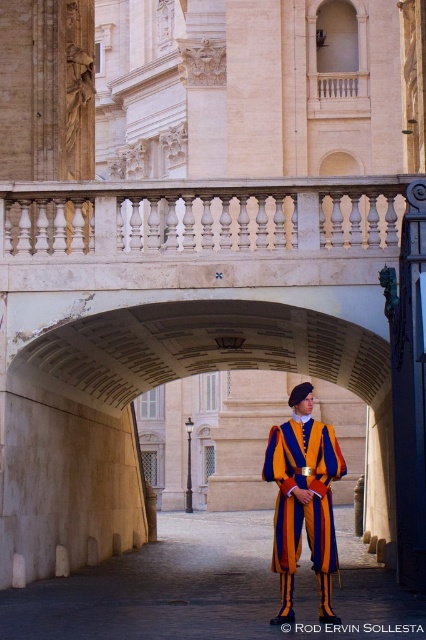
You are a tourist in Vatican City and want to take a photo of the Swiss Guard under the archway. You notice two points marked on your map at coordinates point [62,189] and point [330,589]. Which point should you stand at to ensure the Swiss Guard is fully visible in your photo?

You should stand at point [330,589] because point [62,189] is behind it, which might block the view of the Swiss Guard.

You are standing in the historic building and want to reach the point marked as point [46,198]. If your walking speed is 3 feet per second, how many seconds will it take you to reach that point?

The point [46,198] is 148.66 feet away from the viewer. At a walking speed of 3 feet per second, it would take approximately 49.55 seconds to reach there.

You are an architect designing a replica of this archway. You need to place a decorative element exactly where the white marble balustrade at upper center is located. What are the coordinates for this placement?

The coordinates for placing the decorative element should be at point (201, 216), as that is where the white marble balustrade at upper center is positioned.